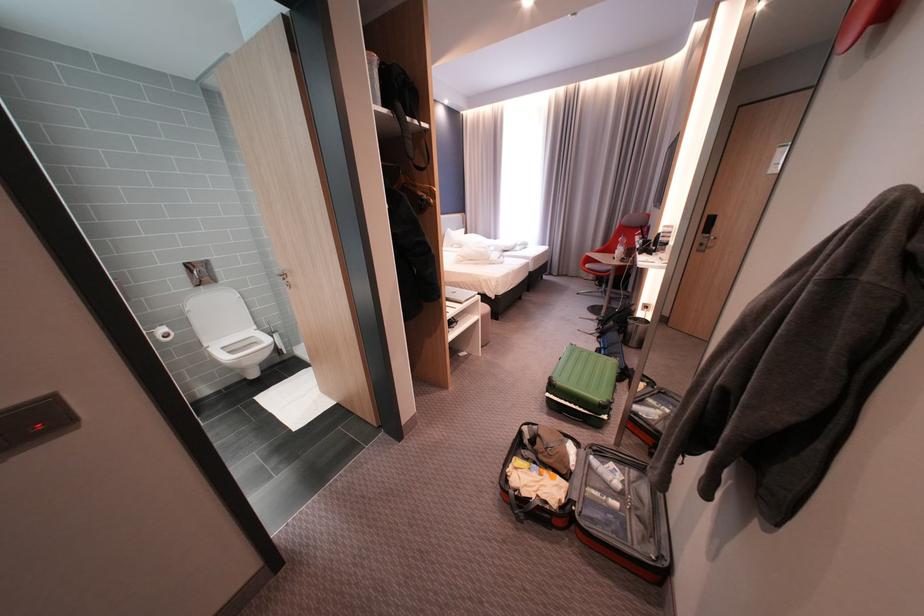
This screenshot has width=924, height=616. What are the coordinates of `black door handle` in the screenshot? It's located at (704, 241).